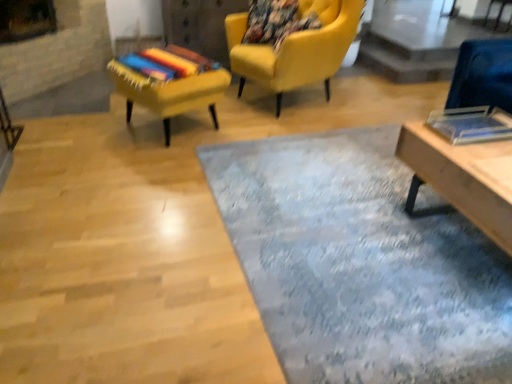
Question: From a real-world perspective, is textured yellow chair at upper left, which is the first chair from left to right, under wooden table at lower right?

Choices:
 (A) no
 (B) yes

Answer: (B)

Question: Is textured yellow chair at upper left, which appears as the 2th chair when viewed from the right, positioned beyond the bounds of wooden table at lower right?

Choices:
 (A) no
 (B) yes

Answer: (B)

Question: Does textured yellow chair at upper left, which is the first chair from left to right, have a greater height compared to wooden table at lower right?

Choices:
 (A) no
 (B) yes

Answer: (A)

Question: Could you tell me if textured yellow chair at upper left, which appears as the 2th chair when viewed from the right, is facing wooden table at lower right?

Choices:
 (A) yes
 (B) no

Answer: (A)

Question: Is textured yellow chair at upper left, which is the first chair from left to right, to the left of wooden table at lower right from the viewer's perspective?

Choices:
 (A) no
 (B) yes

Answer: (B)

Question: From the image's perspective, does textured yellow chair at upper left, which is the first chair from left to right, appear higher than wooden table at lower right?

Choices:
 (A) yes
 (B) no

Answer: (A)

Question: From the image's perspective, is textured blue rug at center beneath textured yellow chair at upper left, which appears as the 2th chair when viewed from the right?

Choices:
 (A) yes
 (B) no

Answer: (A)

Question: Are textured blue rug at center and textured yellow chair at upper left, which is the first chair from left to right, making contact?

Choices:
 (A) yes
 (B) no

Answer: (B)

Question: Is textured blue rug at center taller than textured yellow chair at upper left, which is the first chair from left to right?

Choices:
 (A) yes
 (B) no

Answer: (B)

Question: Does textured blue rug at center come behind textured yellow chair at upper left, which is the first chair from left to right?

Choices:
 (A) no
 (B) yes

Answer: (A)

Question: From a real-world perspective, is textured blue rug at center under textured yellow chair at upper left, which appears as the 2th chair when viewed from the right?

Choices:
 (A) yes
 (B) no

Answer: (A)

Question: Is textured blue rug at center wider than textured yellow chair at upper left, which is the first chair from left to right?

Choices:
 (A) no
 (B) yes

Answer: (B)

Question: From the image's perspective, is textured yellow chair at upper left, which appears as the 2th chair when viewed from the right, below transparent glass table at upper right?

Choices:
 (A) no
 (B) yes

Answer: (B)